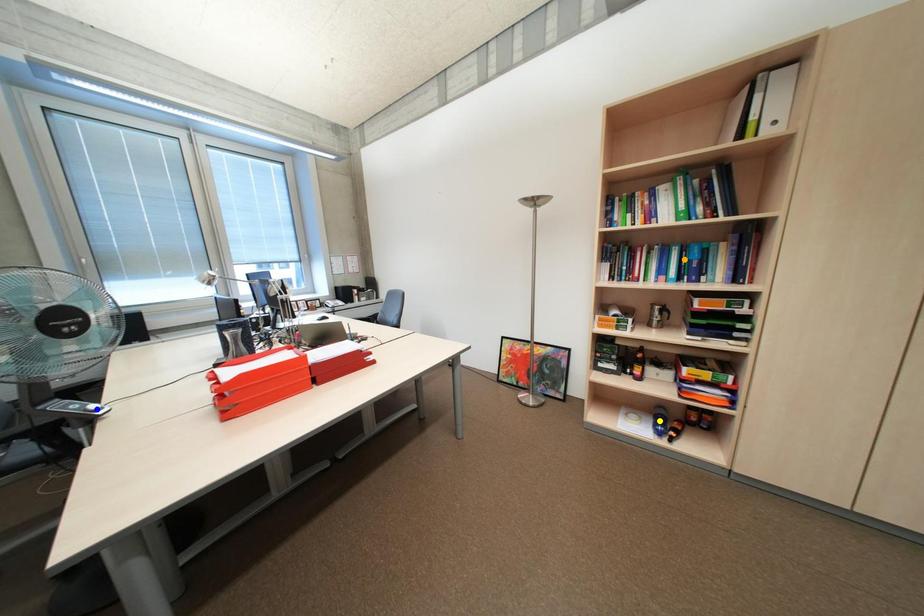
Order these from nearest to farthest:
- blue point
- yellow point
- orange point

blue point
orange point
yellow point